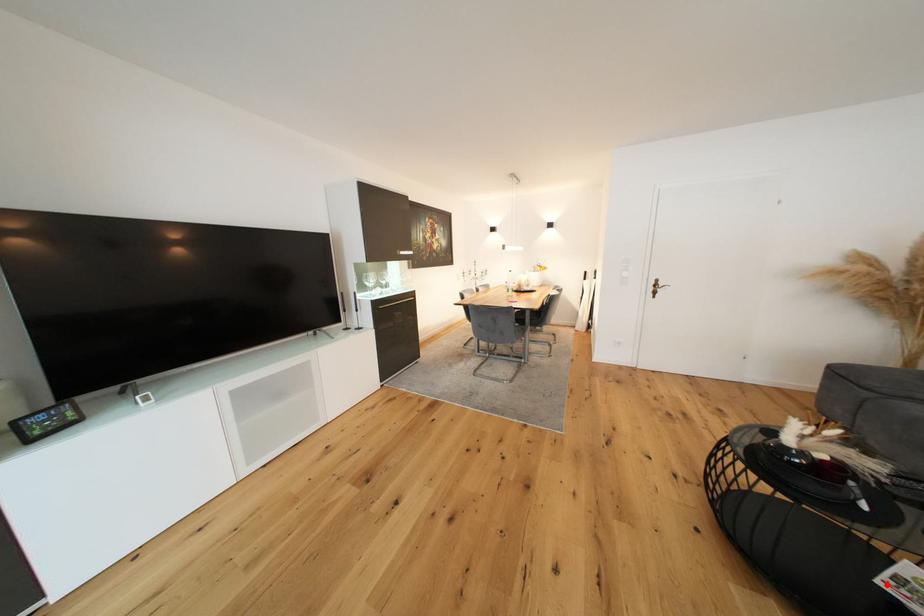
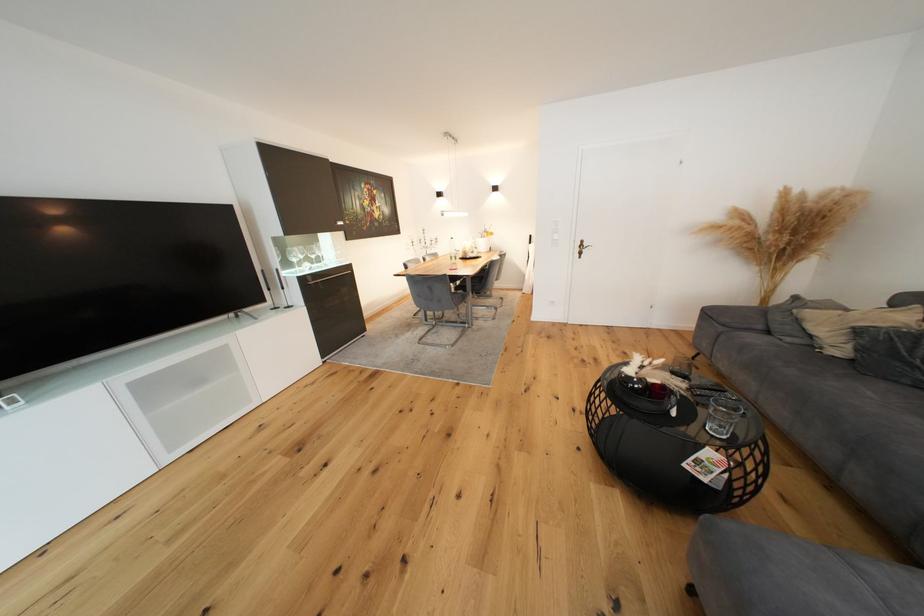
Question: I am providing you with two images of the same scene from different viewpoints. Given a red point in image1, look at the same physical point in image2. Is it:

Choices:
 (A) Closer to the viewpoint
 (B) Farther from the viewpoint

Answer: (A)